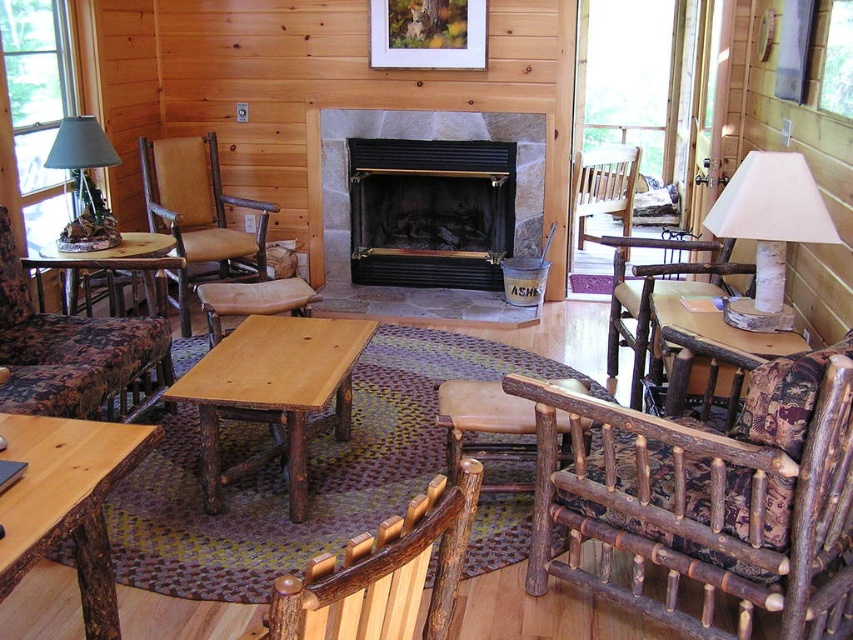
Between point (688, 282) and point (573, 209), which one is positioned behind?

Positioned behind is point (573, 209).

Between wooden armchair at right and wooden chair at center, which one has more height?

Standing taller between the two is wooden chair at center.

Is point (614, 282) positioned before point (579, 205)?

Yes, it is.

I want to click on wooden armchair at right, so click(657, 292).

Is black metal fireplace at center wider than wooden armchair at right?

Indeed, black metal fireplace at center has a greater width compared to wooden armchair at right.

Consider the image. Is black metal fireplace at center closer to the viewer compared to wooden armchair at right?

No, black metal fireplace at center is behind wooden armchair at right.

I want to click on black metal fireplace at center, so pyautogui.click(x=430, y=211).

Locate an element on the screen. black metal fireplace at center is located at coordinates (430, 211).

Looking at this image, which of these two, matte gray lampshade at left or wooden table at center, stands shorter?

With less height is wooden table at center.

Is matte gray lampshade at left positioned at the back of wooden table at center?

Yes.

You are a GUI agent. You are given a task and a screenshot of the screen. Output one action in this format:
    pyautogui.click(x=<x>, y=<y>)
    Task: Click on the matte gray lampshade at left
    
    Given the screenshot: What is the action you would take?
    pyautogui.click(x=84, y=182)